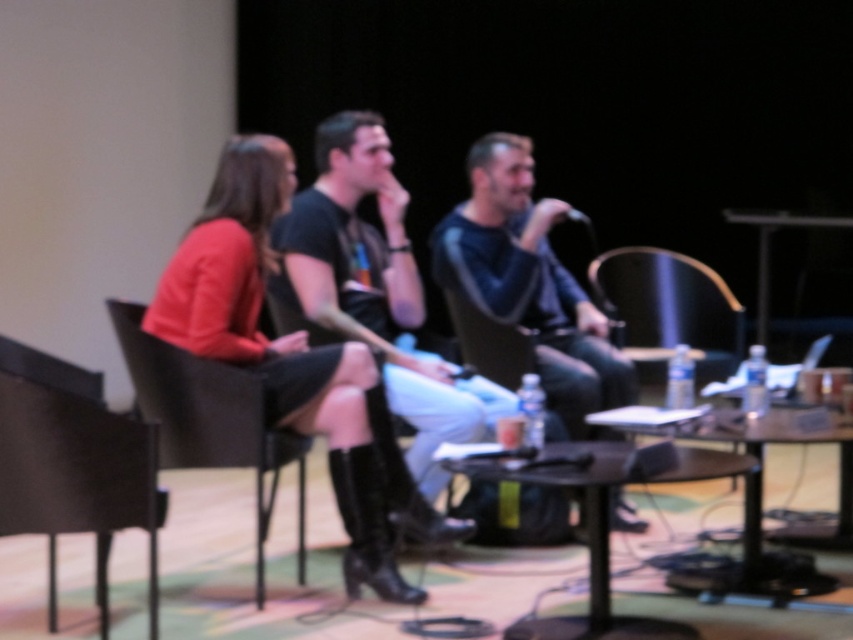
Does dark blue sweater at center have a greater width compared to black leather chair at center?

Yes, dark blue sweater at center is wider than black leather chair at center.

Who is lower down, dark blue sweater at center or black leather chair at center?

black leather chair at center

Is point (572, 397) closer to camera compared to point (689, 276)?

Yes, point (572, 397) is closer to viewer.

Locate an element on the screen. The width and height of the screenshot is (853, 640). dark blue sweater at center is located at coordinates (529, 280).

Who is shorter, matte red sweater at center or wooden table at right?

Standing shorter between the two is wooden table at right.

Is matte red sweater at center to the left of wooden table at right from the viewer's perspective?

Correct, you'll find matte red sweater at center to the left of wooden table at right.

Describe the element at coordinates (279, 346) in the screenshot. This screenshot has height=640, width=853. I see `matte red sweater at center` at that location.

In order to click on matte red sweater at center in this screenshot , I will do `click(279, 346)`.

Is point (96, 452) more distant than point (700, 580)?

That is False.

Between point (148, 468) and point (627, 428), which one is positioned behind?

The point (627, 428) is more distant.

Image resolution: width=853 pixels, height=640 pixels. In order to click on black leather chair at left in this screenshot , I will do `click(73, 464)`.